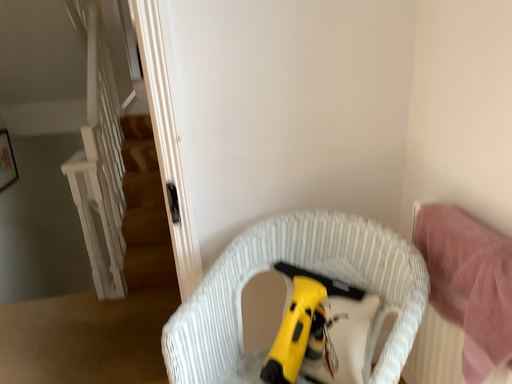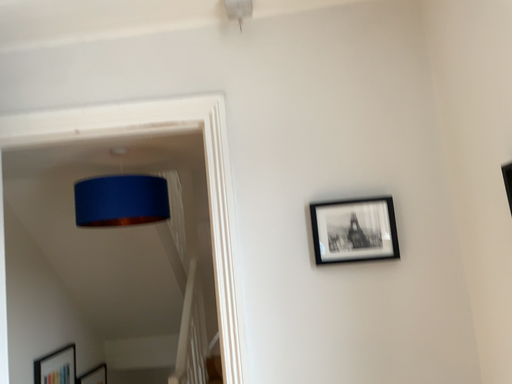
Question: Which way did the camera rotate in the video?

Choices:
 (A) rotated right
 (B) rotated left

Answer: (B)